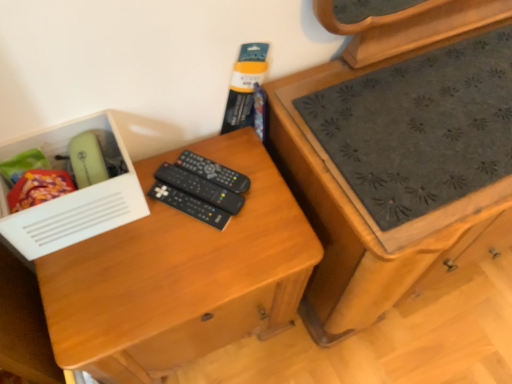
Question: Can you confirm if white plastic box at left is bigger than black plastic remote controls at center, positioned as the third remote control in bottom-to-top order?

Choices:
 (A) no
 (B) yes

Answer: (B)

Question: Does white plastic box at left come in front of black plastic remote controls at center, positioned as the third remote control in bottom-to-top order?

Choices:
 (A) no
 (B) yes

Answer: (B)

Question: Is white plastic box at left positioned with its back to black plastic remote controls at center, which is counted as the 1th remote control, starting from the top?

Choices:
 (A) yes
 (B) no

Answer: (B)

Question: Considering the relative sizes of white plastic box at left and black plastic remote controls at center, positioned as the third remote control in bottom-to-top order, in the image provided, is white plastic box at left shorter than black plastic remote controls at center, positioned as the third remote control in bottom-to-top order,?

Choices:
 (A) yes
 (B) no

Answer: (B)

Question: Is white plastic box at left outside black plastic remote controls at center, positioned as the third remote control in bottom-to-top order?

Choices:
 (A) yes
 (B) no

Answer: (A)

Question: Is the surface of white plastic box at left in direct contact with black plastic remote controls at center, which is counted as the 1th remote control, starting from the top?

Choices:
 (A) no
 (B) yes

Answer: (A)

Question: Can you confirm if wooden chest of drawers at right is positioned to the left of black plastic remote controls at center, acting as the 3th remote control starting from the top?

Choices:
 (A) no
 (B) yes

Answer: (A)

Question: From the image's perspective, does wooden chest of drawers at right appear lower than black plastic remote controls at center, which ranks as the 1th remote control in bottom-to-top order?

Choices:
 (A) no
 (B) yes

Answer: (A)

Question: Does wooden chest of drawers at right come in front of black plastic remote controls at center, which ranks as the 1th remote control in bottom-to-top order?

Choices:
 (A) no
 (B) yes

Answer: (B)

Question: Is black plastic remote controls at center, acting as the 3th remote control starting from the top, completely or partially inside wooden chest of drawers at right?

Choices:
 (A) no
 (B) yes

Answer: (A)

Question: Could you tell me if wooden chest of drawers at right is turned towards black plastic remote controls at center, which ranks as the 1th remote control in bottom-to-top order?

Choices:
 (A) no
 (B) yes

Answer: (A)

Question: From the image's perspective, would you say wooden chest of drawers at right is positioned over black plastic remote controls at center, which ranks as the 1th remote control in bottom-to-top order?

Choices:
 (A) no
 (B) yes

Answer: (B)

Question: Considering the relative sizes of white plastic box at left and black plastic remote controls at center, acting as the 3th remote control starting from the top, in the image provided, is white plastic box at left wider than black plastic remote controls at center, acting as the 3th remote control starting from the top,?

Choices:
 (A) no
 (B) yes

Answer: (A)